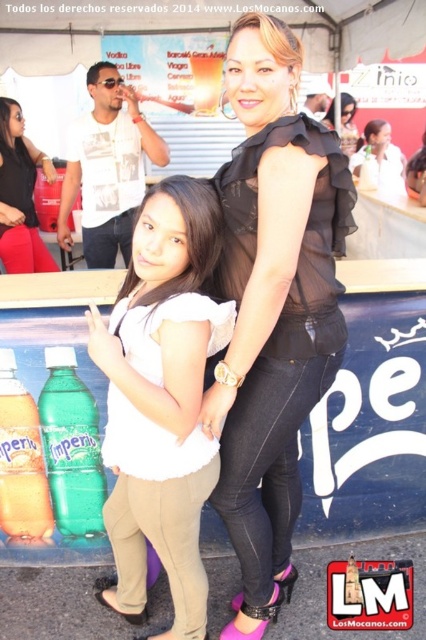
Is black sheer blouse at center bigger than smooth white blouse at center?

Indeed, black sheer blouse at center has a larger size compared to smooth white blouse at center.

Which of these two, black sheer blouse at center or smooth white blouse at center, stands shorter?

Standing shorter between the two is smooth white blouse at center.

Where is `black sheer blouse at center`? The height and width of the screenshot is (640, 426). black sheer blouse at center is located at coordinates (273, 307).

I want to click on green plastic bottle at center, so click(x=71, y=445).

Can you confirm if green plastic bottle at center is shorter than black sheer blouse at upper center?

Yes, green plastic bottle at center is shorter than black sheer blouse at upper center.

Who is more forward, (x=51, y=442) or (x=339, y=99)?

Point (x=51, y=442)

Image resolution: width=426 pixels, height=640 pixels. I want to click on green plastic bottle at center, so click(x=71, y=445).

Is translucent plastic bottle at lower left smaller than white matte shirt at upper center?

Yes.

Image resolution: width=426 pixels, height=640 pixels. I want to click on translucent plastic bottle at lower left, so click(20, 460).